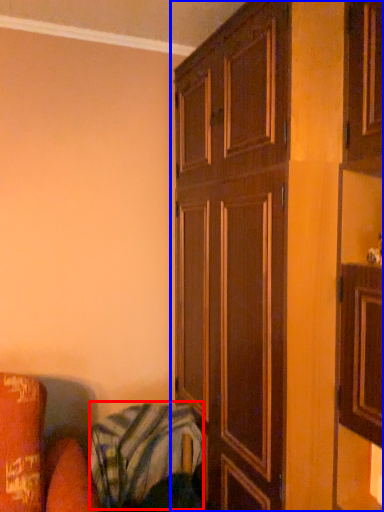
Question: Which point is further to the camera, blanket (highlighted by a red box) or cupboard (highlighted by a blue box)?

Choices:
 (A) blanket
 (B) cupboard

Answer: (A)